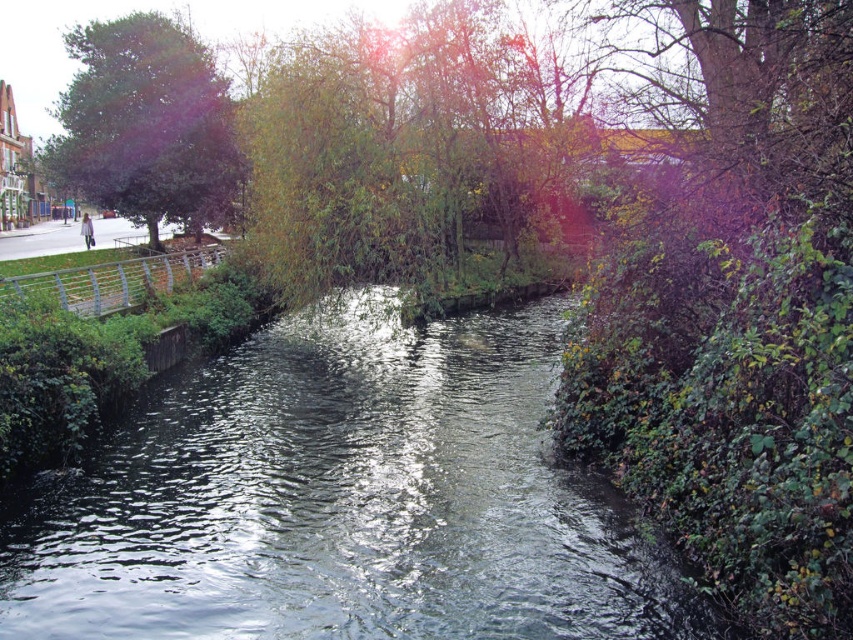
Is point (21, 516) positioned before point (112, 176)?

Yes.

Which of these two, clear water at center or green leafy tree at left, stands shorter?

clear water at center is shorter.

Who is more forward, (373, 371) or (215, 109)?

Point (373, 371) is in front.

Locate an element on the screen. The width and height of the screenshot is (853, 640). clear water at center is located at coordinates (343, 499).